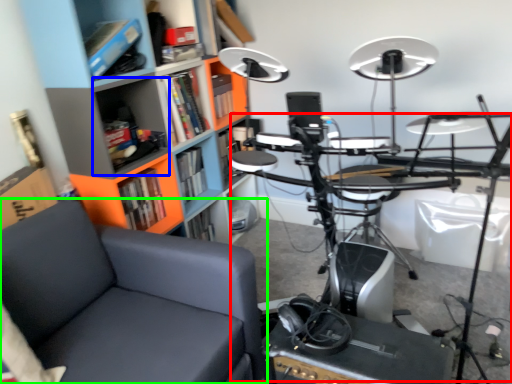
Question: Considering the real-world distances, which object is farthest from computer desk (highlighted by a red box)? shelf (highlighted by a blue box) or chair (highlighted by a green box)?

Choices:
 (A) shelf
 (B) chair

Answer: (A)